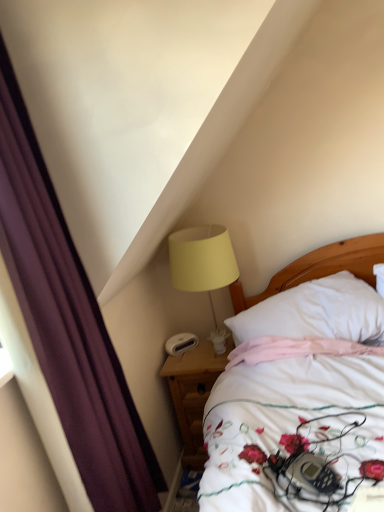
Question: Could white plastic alarm clock at lower center be considered to be inside wooden nightstand at lower center?

Choices:
 (A) yes
 (B) no

Answer: (B)

Question: Is wooden nightstand at lower center not close to white plastic alarm clock at lower center?

Choices:
 (A) yes
 (B) no

Answer: (B)

Question: Is wooden nightstand at lower center looking in the opposite direction of white plastic alarm clock at lower center?

Choices:
 (A) no
 (B) yes

Answer: (A)

Question: Does wooden nightstand at lower center have a greater height compared to white plastic alarm clock at lower center?

Choices:
 (A) no
 (B) yes

Answer: (B)

Question: Does wooden nightstand at lower center appear on the left side of white plastic alarm clock at lower center?

Choices:
 (A) no
 (B) yes

Answer: (A)

Question: From a real-world perspective, is white plastic alarm clock at lower center physically located above or below purple fabric curtain at left?

Choices:
 (A) above
 (B) below

Answer: (B)

Question: In terms of width, does white plastic alarm clock at lower center look wider or thinner when compared to purple fabric curtain at left?

Choices:
 (A) thin
 (B) wide

Answer: (A)

Question: Which is correct: white plastic alarm clock at lower center is inside purple fabric curtain at left, or outside of it?

Choices:
 (A) inside
 (B) outside

Answer: (B)

Question: Is white plastic alarm clock at lower center to the left or to the right of purple fabric curtain at left in the image?

Choices:
 (A) right
 (B) left

Answer: (A)

Question: Looking at their shapes, would you say white soft pillow at center is wider or thinner than wooden nightstand at lower center?

Choices:
 (A) thin
 (B) wide

Answer: (B)

Question: Is white soft pillow at center to the left or to the right of wooden nightstand at lower center in the image?

Choices:
 (A) right
 (B) left

Answer: (A)

Question: Considering the positions of white soft pillow at center and wooden nightstand at lower center in the image, is white soft pillow at center taller or shorter than wooden nightstand at lower center?

Choices:
 (A) short
 (B) tall

Answer: (A)

Question: Looking at the image, does white soft pillow at center seem bigger or smaller compared to wooden nightstand at lower center?

Choices:
 (A) big
 (B) small

Answer: (B)

Question: In terms of width, does purple fabric curtain at left look wider or thinner when compared to white soft pillow at center?

Choices:
 (A) wide
 (B) thin

Answer: (B)

Question: From their relative heights in the image, would you say purple fabric curtain at left is taller or shorter than white soft pillow at center?

Choices:
 (A) short
 (B) tall

Answer: (B)